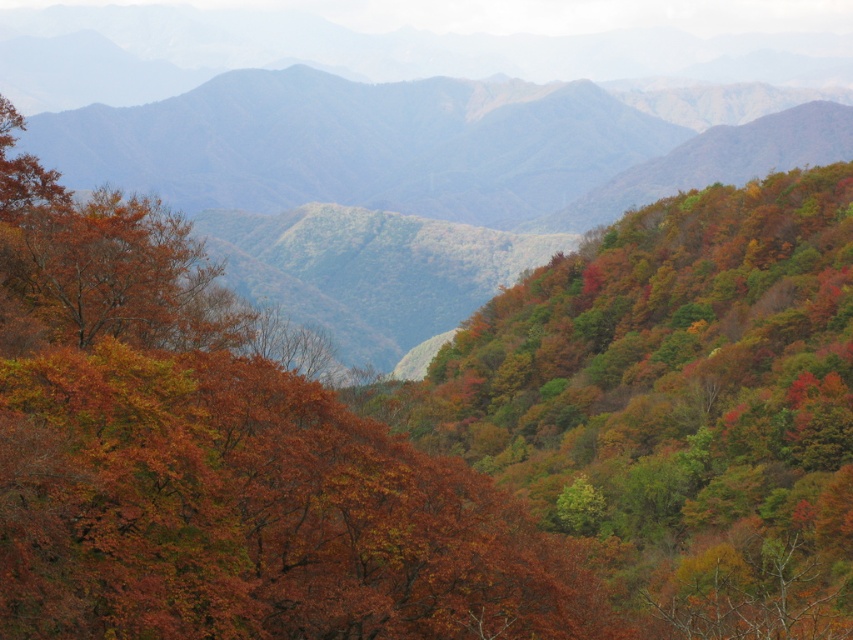
Question: Does autumn leaves at center have a greater width compared to multicolored foliage at center?

Choices:
 (A) yes
 (B) no

Answer: (B)

Question: Does autumn leaves at center come behind multicolored foliage at center?

Choices:
 (A) yes
 (B) no

Answer: (B)

Question: Does autumn leaves at center appear under multicolored foliage at center?

Choices:
 (A) no
 (B) yes

Answer: (B)